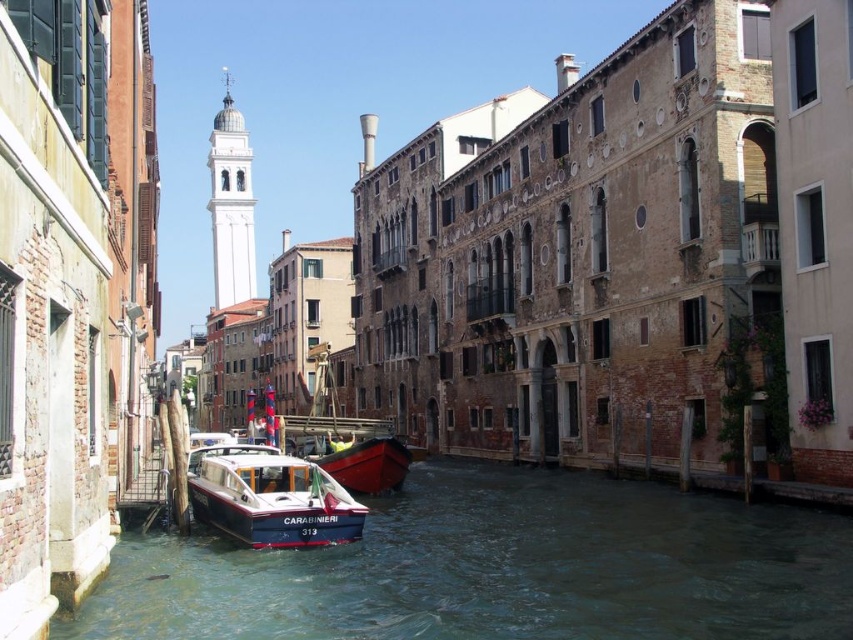
You are a tourist standing on the left side of the canal looking towards the right side. You see the blue polished wood boat at center and the red polished wood boat at center. Which boat is closer to your left side?

The blue polished wood boat at center is closer to your left side because it is positioned to the left of the red polished wood boat at center from your perspective.

Consider the image. You are a tourist standing on a bridge overlooking the canal and want to take a photo of both the clear water at lower left and the red polished wood boat at center. Which object will appear larger in your photo?

The clear water at lower left will appear larger in the photo because it is closer to the viewer than the red polished wood boat at center.